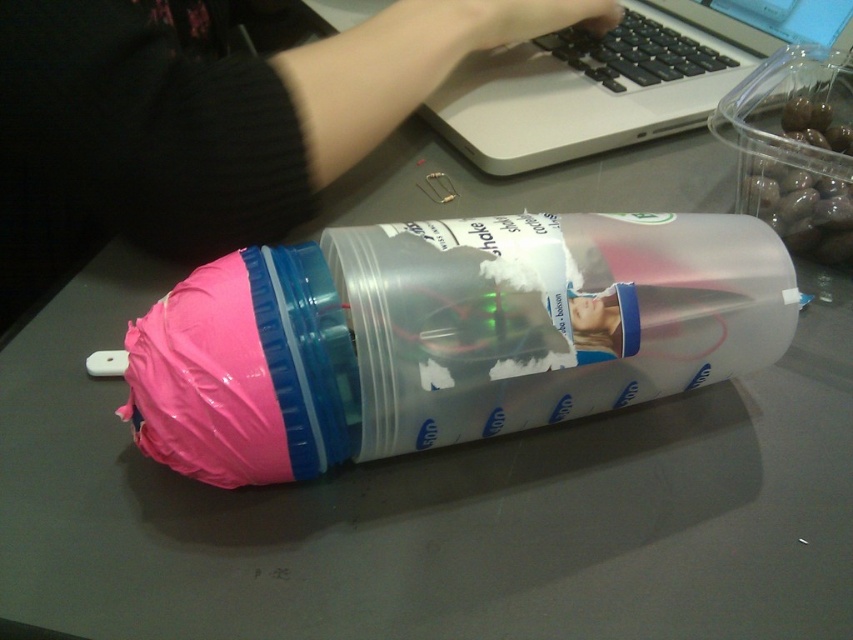
You are organizing your desk and need to place both the silver metallic laptop at upper center and the pink matte plastic hand at upper center. Since the desk has limited space, which object should you prioritize keeping if you can only keep one due to size?

The silver metallic laptop at upper center is larger in size than the pink matte plastic hand at upper center, so you should prioritize keeping the silver metallic laptop at upper center to make better use of the limited desk space.

You are trying to reach the point marked at coordinates point (x=613, y=100) in the workspace. Your hand is currently 25 inches away from that point. Can you safely extend your arm to reach it without moving your chair?

The distance between point (x=613, y=100) and the viewer is 27.80 inches. Since your hand is already 25 inches away, you need an additional 2.8 inches to reach it. Depending on your arm length, it might be possible to extend further, but there is a small gap remaining.

You are organizing your desk and notice the silver metallic laptop at upper center and the pink matte plastic hand at upper center. Which object is positioned to the right side of the desk?

The silver metallic laptop at upper center is positioned to the right of the pink matte plastic hand at upper center, so the laptop is on the right side of the desk.